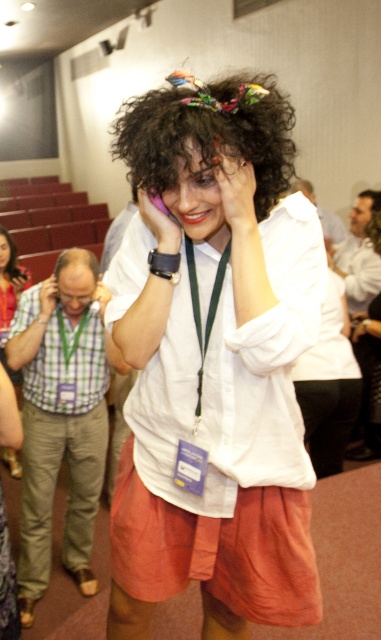
You are an event planner organizing a photo shoot in this conference room. You need to ensure that the curly dark brown hair at center and the white matte hand at center are both visible in the photo. Given their sizes, which object should be placed closer to the camera to ensure both are clearly visible?

The curly dark brown hair at center is bigger than the white matte hand at center. To ensure both are clearly visible, the white matte hand at center should be placed closer to the camera since it is smaller and needs to be magnified to match the visibility of the larger object.

You are organizing a photo shoot and need to ensure that the white cotton shirt at center and the purple matte phone at upper center are both visible in the frame. Based on their sizes, which object is more likely to be fully visible without cropping?

The white cotton shirt at center is wider than the purple matte phone at upper center, so it is more likely to be fully visible without cropping.